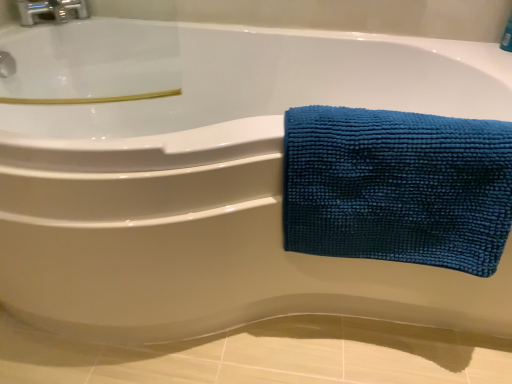
You are a GUI agent. You are given a task and a screenshot of the screen. Output one action in this format:
    pyautogui.click(x=<x>, y=<y>)
    Task: Click on the blue microfiber towel at right
    
    Given the screenshot: What is the action you would take?
    pyautogui.click(x=397, y=187)

Describe the element at coordinates (397, 187) in the screenshot. The width and height of the screenshot is (512, 384). I see `blue microfiber towel at right` at that location.

Where is `blue microfiber towel at right`? blue microfiber towel at right is located at coordinates (397, 187).